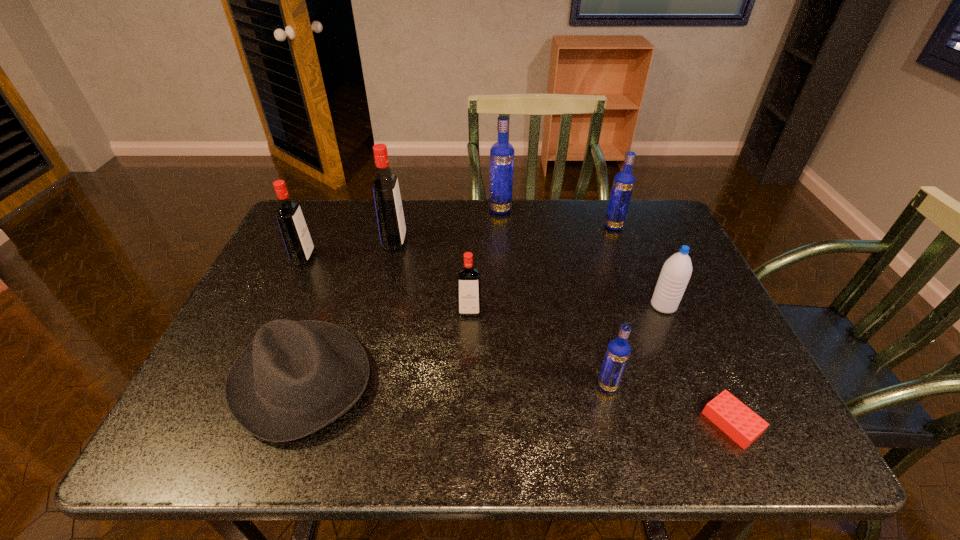
Locate which object ranks in proximity to the Lego. Please provide its 2D coordinates. Your answer should be formatted as a tuple, i.e. [(x, y)], where the tuple contains the x and y coordinates of a point satisfying the conditions above.

[(618, 351)]

Identify the location of object that ranks as the closest to the fifth object from left to right. (391, 224).

Locate an element on the screen. This screenshot has width=960, height=540. vodka that stands as the closest to the rightmost blue vodka is located at coordinates (501, 153).

Find the location of `the fourth closest vodka relative to the third vodka from left to right`. the fourth closest vodka relative to the third vodka from left to right is located at coordinates (296, 236).

The image size is (960, 540). I want to click on blue vodka object that ranks as the second closest to the smallest blue vodka, so click(x=501, y=153).

Where is `blue vodka identified as the second closest to the fifth nearest vodka`? Image resolution: width=960 pixels, height=540 pixels. blue vodka identified as the second closest to the fifth nearest vodka is located at coordinates (618, 351).

Locate which red vodka is the closest to the second farthest blue vodka. Please provide its 2D coordinates. Your answer should be formatted as a tuple, i.e. [(x, y)], where the tuple contains the x and y coordinates of a point satisfying the conditions above.

[(468, 279)]

Locate which red vodka is the second closest to the fifth vodka from right to left. Please provide its 2D coordinates. Your answer should be formatted as a tuple, i.e. [(x, y)], where the tuple contains the x and y coordinates of a point satisfying the conditions above.

[(468, 279)]

The height and width of the screenshot is (540, 960). Identify the location of vacant area in the image that satisfies the following two spatial constraints: 1. on the front and back of the blue water bottle; 2. on the right side of the fifth vodka from right to left. (380, 306).

In order to click on free space that satisfies the following two spatial constraints: 1. on the front side of the farthest vodka; 2. on the front and back of the leftmost red vodka in this screenshot , I will do `click(503, 258)`.